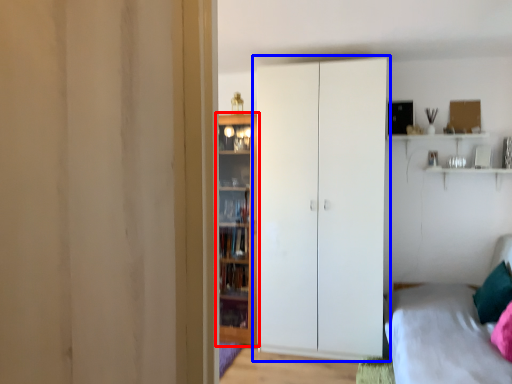
Question: Which point is closer to the camera, door (highlighted by a red box) or cupboard (highlighted by a blue box)?

Choices:
 (A) door
 (B) cupboard

Answer: (B)